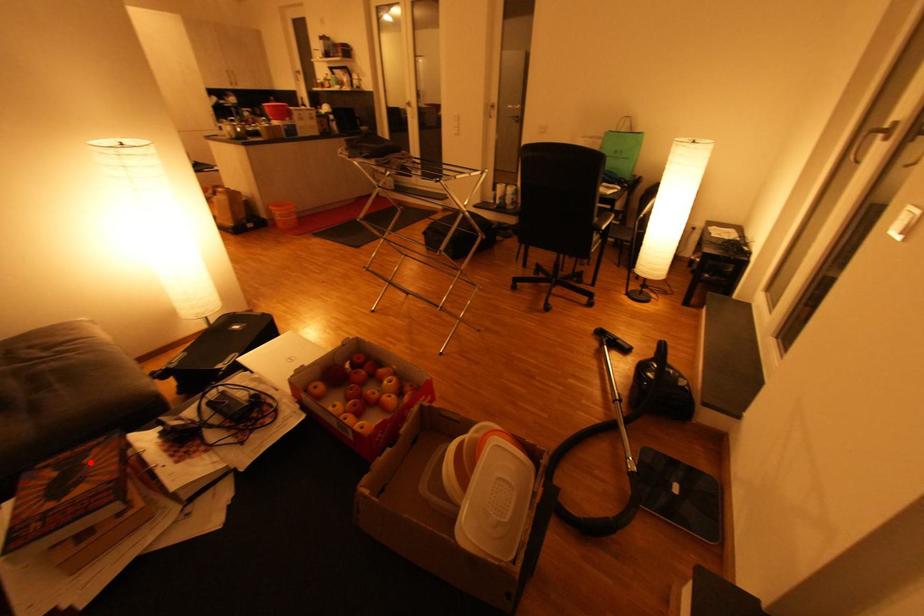
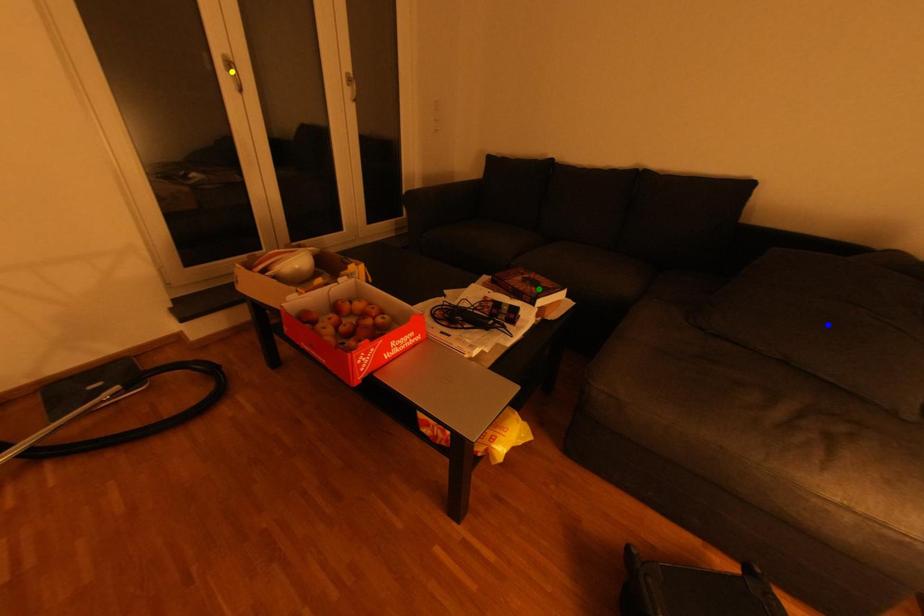
Question: I am providing you with two images of the same scene from different viewpoints. A red point is marked on the first image. You are given multiple points on the second image. Which spot in image 2 lines up with the point in image 1?

Choices:
 (A) blue point
 (B) green point
 (C) yellow point

Answer: (B)